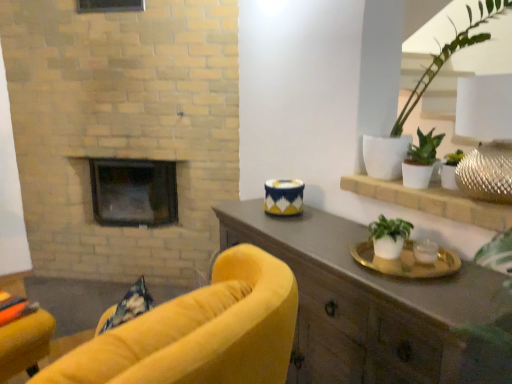
Question: Considering the relative positions of black glass fireplace at center and white ceramic plant at upper right in the image provided, is black glass fireplace at center to the left or to the right of white ceramic plant at upper right?

Choices:
 (A) right
 (B) left

Answer: (B)

Question: Choose the correct answer: Is black glass fireplace at center inside white ceramic plant at upper right or outside it?

Choices:
 (A) outside
 (B) inside

Answer: (A)

Question: Which of these objects is positioned closest to the velvet yellow armchair at lower left, which appears as the 1th chair when viewed from the left?

Choices:
 (A) blue and white ceramic candle holder at center
 (B) matte brown cabinet at right
 (C) white ceramic plant at upper right
 (D) white matte plant at right, the first houseplant positioned from the bottom
 (E) white matte plant pot at right, the 3th houseplant in the bottom-to-top sequence

Answer: (B)

Question: Estimate the real-world distances between objects in this image. Which object is closer to the white ceramic plant at upper right?

Choices:
 (A) green matte houseplant at upper right, the 2th houseplant when ordered from bottom to top
 (B) blue and white ceramic candle holder at center
 (C) black glass fireplace at center
 (D) white matte plant pot at right, the 3th houseplant in the bottom-to-top sequence
 (E) velvet yellow armchair at center, which is the 1th chair in front-to-back order

Answer: (D)